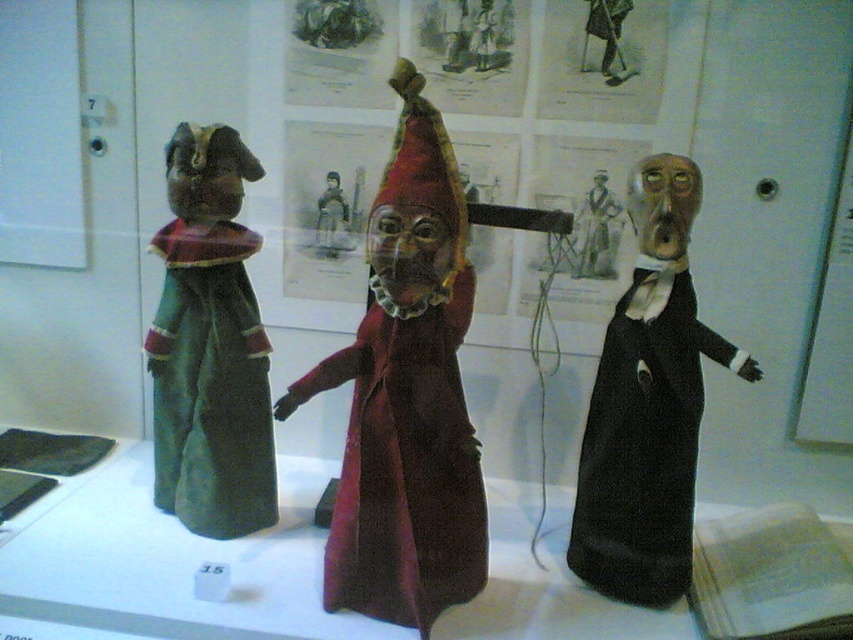
You are a museum curator arranging an exhibition. You need to determine the spatial relationship between the velvet maroon coat at center and the green felt doll at left. Which object is closer to the viewer?

The velvet maroon coat at center is closer to the viewer than the green felt doll at left because it is positioned in front of it.

You are a visitor standing in front of the three puppet figures displayed on the white surface. You notice two points marked on the image at coordinates point (396, 604) and point (236, 387). Which of these points is nearer to your viewpoint?

Point (396, 604) is closer to the camera than point (236, 387), so the point (396, 604) is nearer to your viewpoint.

You are a museum curator arranging these puppets for an exhibition. You need to ensure that the green felt doll at left and the black velvet dress at right are placed side by side on a shelf. Given their widths, which puppet should be placed first to accommodate both on the shelf without overlapping?

The green felt doll at left has a lesser width compared to the black velvet dress at right. Therefore, place the green felt doll at left first, followed by the black velvet dress at right to ensure they fit side by side without overlapping.